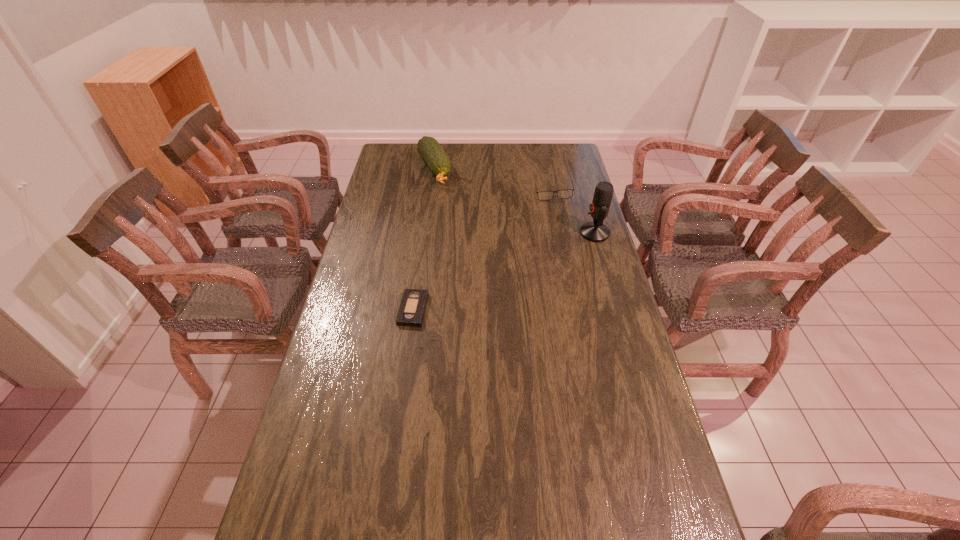
Locate an element on the screen. The height and width of the screenshot is (540, 960). vacant space located at the blossom end of the second tallest object is located at coordinates (449, 212).

You are a GUI agent. You are given a task and a screenshot of the screen. Output one action in this format:
    pyautogui.click(x=<x>, y=<y>)
    Task: Click on the vacant region located at the blossom end of the second tallest object
    
    Given the screenshot: What is the action you would take?
    pyautogui.click(x=447, y=208)

Image resolution: width=960 pixels, height=540 pixels. In order to click on vacant space located 0.150m at the blossom end of the second tallest object in this screenshot , I will do `click(447, 210)`.

At what (x,y) coordinates should I click in order to perform the action: click on vacant region located with the lenses facing outward on the spectacles. Please return your answer as a coordinate pair (x, y). This screenshot has height=540, width=960. Looking at the image, I should click on (511, 245).

Locate an element on the screen. The width and height of the screenshot is (960, 540). vacant position located with the lenses facing outward on the spectacles is located at coordinates (515, 241).

Where is `free region located 0.280m with the lenses facing outward on the spectacles`? Image resolution: width=960 pixels, height=540 pixels. free region located 0.280m with the lenses facing outward on the spectacles is located at coordinates (516, 238).

This screenshot has height=540, width=960. What are the coordinates of `object that is at the far edge` in the screenshot? It's located at coord(437,160).

The height and width of the screenshot is (540, 960). I want to click on microphone present at the right edge, so click(x=596, y=231).

I want to click on spectacles that is at the right edge, so click(566, 193).

Image resolution: width=960 pixels, height=540 pixels. In the image, there is a desktop. What are the coordinates of `vacant space at the far edge` in the screenshot? It's located at (524, 144).